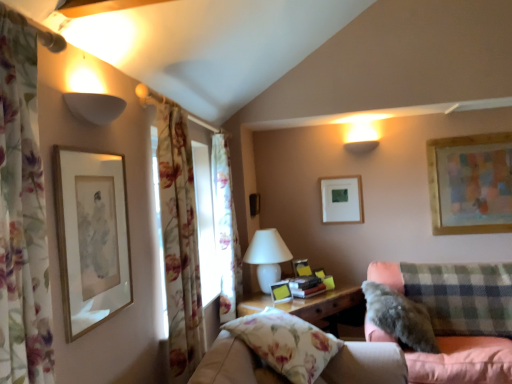
Question: From a real-world perspective, does white ceramic table lamp at center sit lower than floral fabric curtain at left, the third curtain positioned from the back?

Choices:
 (A) no
 (B) yes

Answer: (B)

Question: Would you consider white ceramic table lamp at center to be distant from floral fabric curtain at left, which is the 1th curtain in front-to-back order?

Choices:
 (A) yes
 (B) no

Answer: (A)

Question: Does white ceramic table lamp at center appear on the right side of floral fabric curtain at left, which is the 1th curtain in front-to-back order?

Choices:
 (A) no
 (B) yes

Answer: (B)

Question: Can you confirm if white ceramic table lamp at center is bigger than floral fabric curtain at left, which is the 1th curtain in front-to-back order?

Choices:
 (A) yes
 (B) no

Answer: (A)

Question: Can floral fabric curtain at left, which is the 1th curtain in front-to-back order, be found inside white ceramic table lamp at center?

Choices:
 (A) no
 (B) yes

Answer: (A)

Question: In the image, is white matte picture frame at upper center, which is counted as the fourth picture frame, starting from the front, positioned in front of or behind white matte lampshade at upper left?

Choices:
 (A) front
 (B) behind

Answer: (B)

Question: From a real-world perspective, is white matte picture frame at upper center, which is counted as the fourth picture frame, starting from the front, positioned above or below white matte lampshade at upper left?

Choices:
 (A) below
 (B) above

Answer: (A)

Question: Based on their positions, is white matte picture frame at upper center, which ranks as the 3th picture frame in left-to-right order, located to the left or right of white matte lampshade at upper left?

Choices:
 (A) right
 (B) left

Answer: (A)

Question: Do you think white matte picture frame at upper center, which ranks as the 3th picture frame in left-to-right order, is within white matte lampshade at upper left, or outside of it?

Choices:
 (A) outside
 (B) inside

Answer: (A)

Question: From the image's perspective, relative to gold-framed artwork at upper left, the 1th picture frame positioned from the front, is white matte lampshade at upper left above or below?

Choices:
 (A) below
 (B) above

Answer: (B)

Question: In terms of width, does white matte lampshade at upper left look wider or thinner when compared to gold-framed artwork at upper left, which appears as the 4th picture frame when viewed from the back?

Choices:
 (A) thin
 (B) wide

Answer: (B)

Question: Is white matte lampshade at upper left taller or shorter than gold-framed artwork at upper left, which is the 1th picture frame in left-to-right order?

Choices:
 (A) short
 (B) tall

Answer: (A)

Question: Is white matte lampshade at upper left situated inside gold-framed artwork at upper left, which is the 1th picture frame in left-to-right order, or outside?

Choices:
 (A) inside
 (B) outside

Answer: (B)

Question: From the image's perspective, is fluffy gray pillow at lower right positioned above or below white matte picture frame at upper center, which ranks as the 3th picture frame in left-to-right order?

Choices:
 (A) above
 (B) below

Answer: (B)

Question: Is fluffy gray pillow at lower right in front of or behind white matte picture frame at upper center, marked as the second picture frame in a right-to-left arrangement, in the image?

Choices:
 (A) behind
 (B) front

Answer: (B)